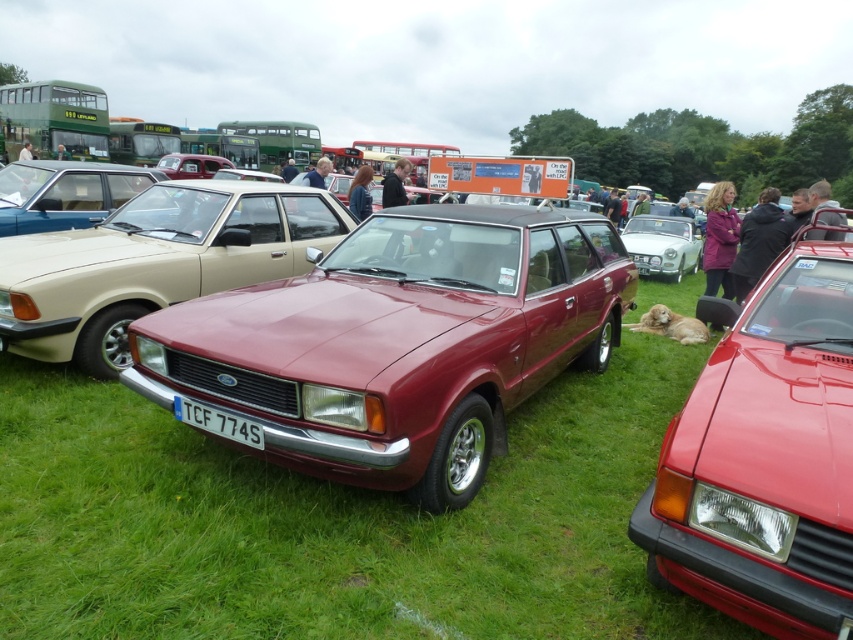
You are a photographer at the car show and want to capture both the satin burgundy station wagon at center and the satin beige station wagon at left in a single shot. Which wagon should you position closer to the camera to ensure both are fully visible?

The satin beige station wagon at left should be positioned closer to the camera because it is shorter than the satin burgundy station wagon at center, allowing both to fit within the frame when the shorter one is nearer.

You are standing at the camera position and want to take a photo of the maroon metallic station wagon at center. If your camera has a maximum focus range of 9 feet, will you be able to capture the wagon clearly?

The distance between the maroon metallic station wagon at center and the camera is 8.98 feet, which is within the camera maximum focus range of 9 feet. Therefore, you can capture the wagon clearly.

You are a photographer at the car show. You want to take a photo of the satin burgundy station wagon at center and the white glossy car at center. Which one is closer to the camera?

The satin burgundy station wagon at center is positioned under the white glossy car at center, so the white glossy car at center is closer to the camera.